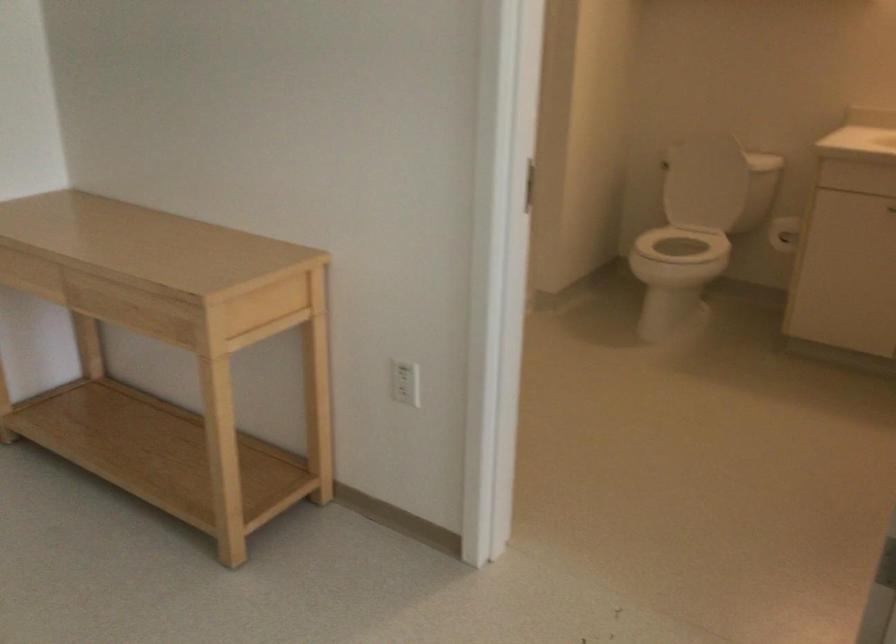
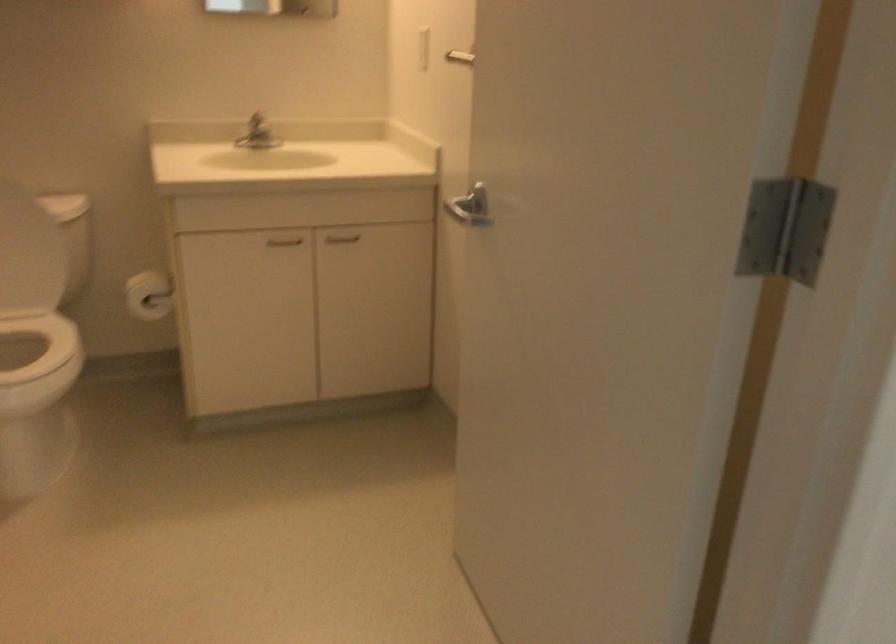
The point at (703, 243) is marked in the first image. Where is the corresponding point in the second image?

(22, 341)